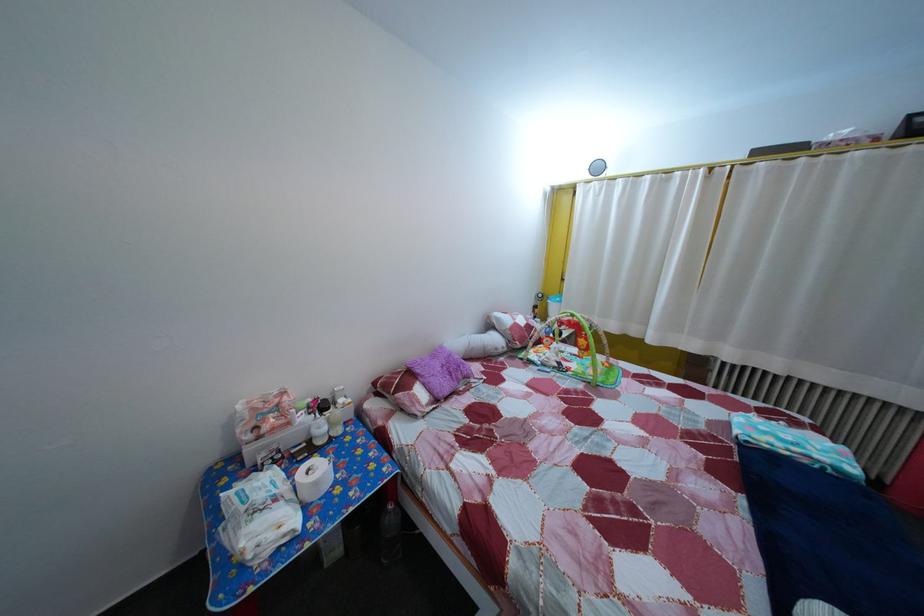
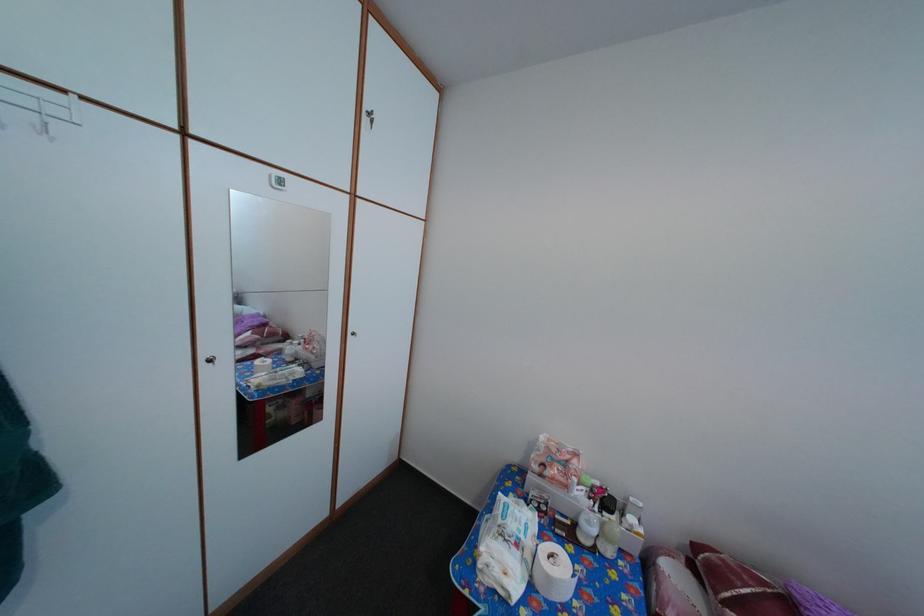
In the second image, find the point that corresponds to (325,491) in the first image.

(558, 586)